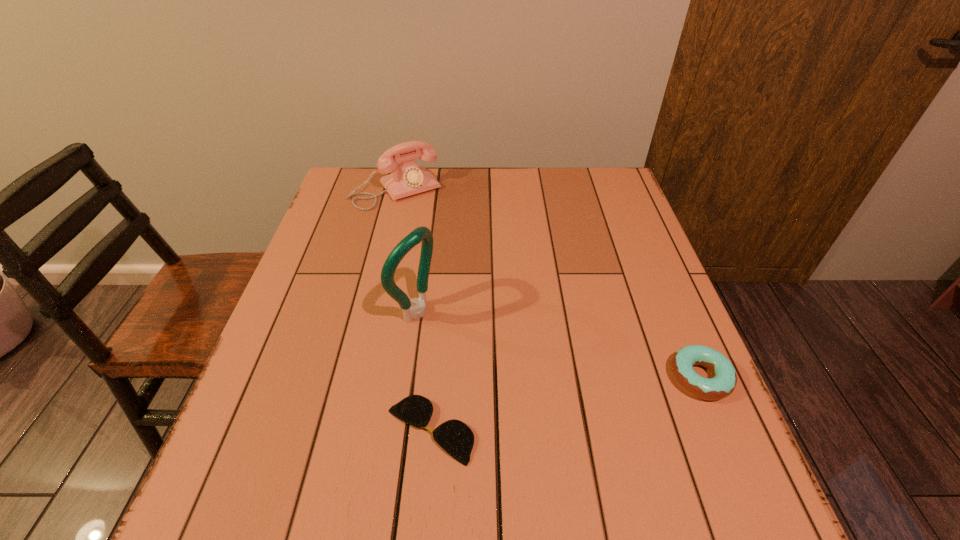
You are a GUI agent. You are given a task and a screenshot of the screen. Output one action in this format:
    pyautogui.click(x=<x>, y=<y>)
    Task: Click on the free space located 0.070m at the jaws of the tallest object
    The width and height of the screenshot is (960, 540).
    Given the screenshot: What is the action you would take?
    pyautogui.click(x=458, y=338)

Image resolution: width=960 pixels, height=540 pixels. I want to click on blank area located 0.130m at the jaws of the tallest object, so click(x=482, y=349).

Locate an element on the screen. Image resolution: width=960 pixels, height=540 pixels. free location located 0.150m on the dial of the farthest object is located at coordinates (435, 237).

You are a GUI agent. You are given a task and a screenshot of the screen. Output one action in this format:
    pyautogui.click(x=<x>, y=<y>)
    Task: Click on the vacant space situated on the dial of the farthest object
    This screenshot has height=540, width=960.
    Given the screenshot: What is the action you would take?
    pyautogui.click(x=423, y=221)

Locate an element on the screen. The image size is (960, 540). vacant point located 0.310m on the dial of the farthest object is located at coordinates (462, 272).

The width and height of the screenshot is (960, 540). Find the location of `object that is at the far edge`. object that is at the far edge is located at coordinates (409, 178).

The width and height of the screenshot is (960, 540). Identify the location of object present at the near edge. (455, 437).

You are a GUI agent. You are given a task and a screenshot of the screen. Output one action in this format:
    pyautogui.click(x=<x>, y=<y>)
    Task: Click on the object at the left edge
    Image resolution: width=960 pixels, height=540 pixels.
    Given the screenshot: What is the action you would take?
    pyautogui.click(x=409, y=178)

This screenshot has height=540, width=960. I want to click on object that is at the right edge, so click(723, 383).

The height and width of the screenshot is (540, 960). In order to click on object that is at the far left corner in this screenshot , I will do `click(409, 178)`.